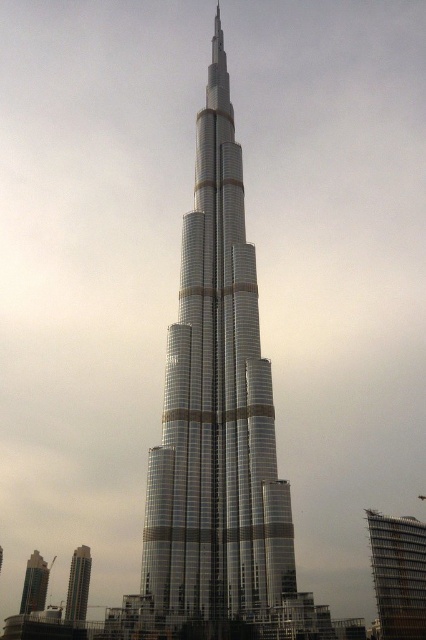
Is glassy metallic skyscraper at center shorter than metallic glass skyscraper at lower left?

No.

Which is behind, point (204, 582) or point (34, 582)?

The point (34, 582) is more distant.

Locate an element on the screen. This screenshot has width=426, height=640. glassy metallic skyscraper at center is located at coordinates (216, 408).

Based on the photo, which of these two, silver metallic building at lower left or metallic glass skyscraper at lower left, stands taller?

metallic glass skyscraper at lower left

Does point (71, 556) come closer to viewer compared to point (25, 577)?

No, (71, 556) is further to viewer.

What do you see at coordinates (77, 586) in the screenshot? Image resolution: width=426 pixels, height=640 pixels. I see `silver metallic building at lower left` at bounding box center [77, 586].

Locate an element on the screen. silver metallic building at lower left is located at coordinates (77, 586).

Which of these two, glassy metallic skyscraper at center or silver metallic building at lower left, stands shorter?

Standing shorter between the two is silver metallic building at lower left.

Identify the location of glassy metallic skyscraper at center. (216, 408).